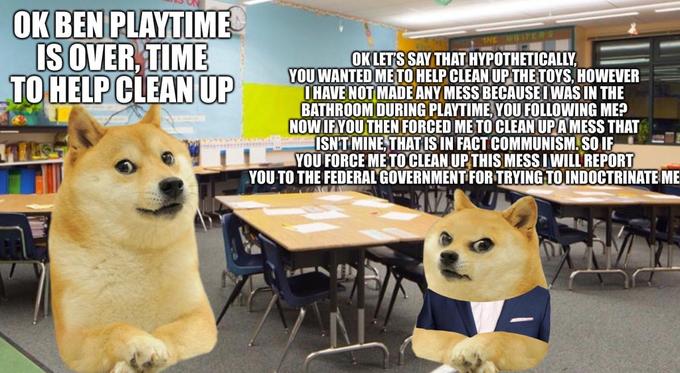
The height and width of the screenshot is (373, 680). Identify the location of clock. (241, 18).